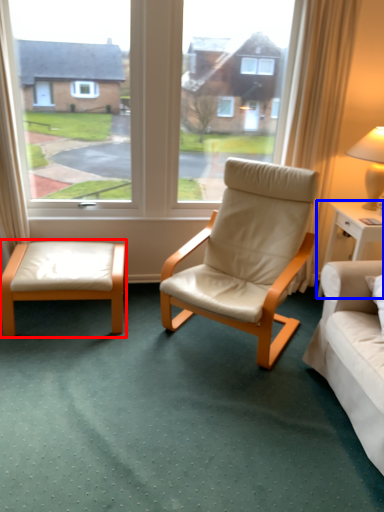
Question: Among these objects, which one is farthest to the camera, table (highlighted by a red box) or nightstand (highlighted by a blue box)?

Choices:
 (A) table
 (B) nightstand

Answer: (B)